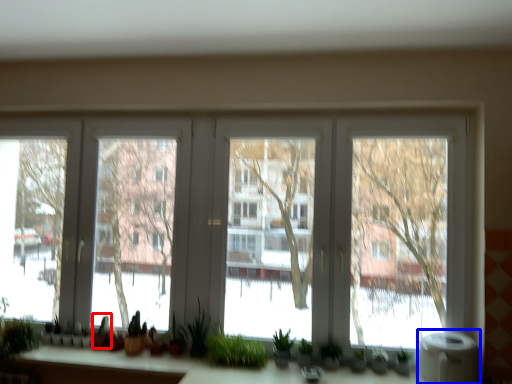
Question: Which point is closer to the camera, plant (highlighted by a red box) or water heater (highlighted by a blue box)?

Choices:
 (A) plant
 (B) water heater

Answer: (B)